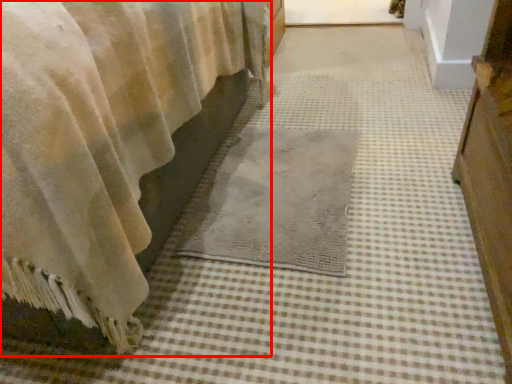
Question: Observing the image, what is the correct spatial positioning of curtain (annotated by the red box) in reference to mat?

Choices:
 (A) right
 (B) left

Answer: (B)